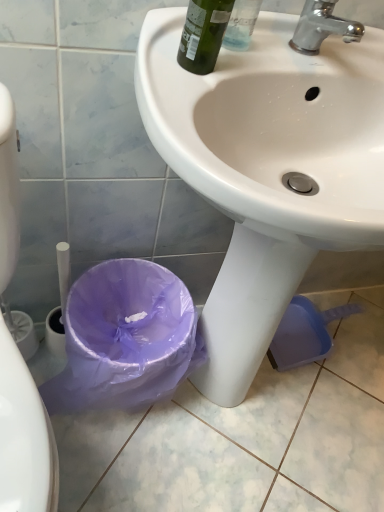
Locate an element on the screen. The width and height of the screenshot is (384, 512). free spot in front of green glass bottle at upper center is located at coordinates (181, 104).